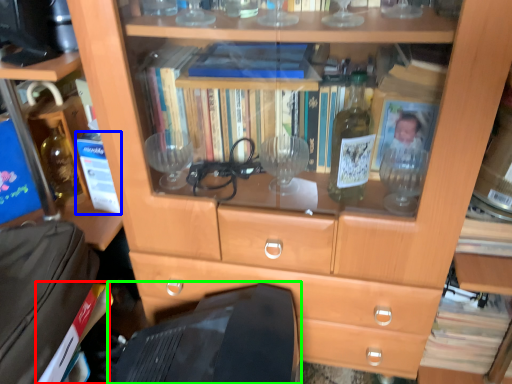
Question: Based on their relative distances, which object is nearer to paperback book (highlighted by a red box)? Choose from paperback book (highlighted by a blue box) and computer monitor (highlighted by a green box).

Choices:
 (A) paperback book
 (B) computer monitor

Answer: (B)